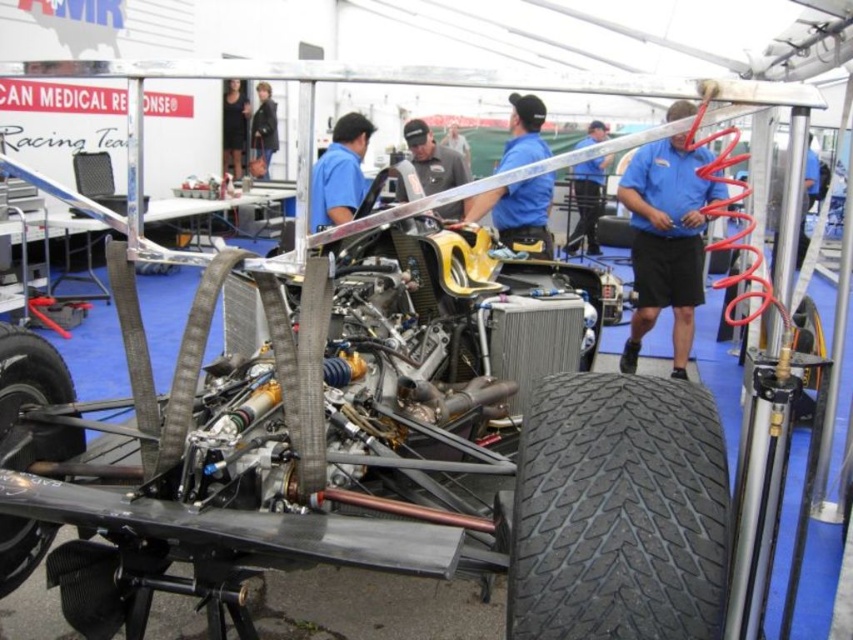
Question: From the image, what is the correct spatial relationship of black rubber tire at lower right in relation to black rubber tire at lower left?

Choices:
 (A) above
 (B) below

Answer: (A)

Question: Does black rubber tire at lower right appear under gray fabric shirt at center?

Choices:
 (A) no
 (B) yes

Answer: (B)

Question: Is black rubber tire at lower left wider than blue shirt at center?

Choices:
 (A) yes
 (B) no

Answer: (B)

Question: Which object is the closest to the blue shirt at center?

Choices:
 (A) blue smooth shirt at center
 (B) gray fabric shirt at center

Answer: (B)

Question: Among these objects, which one is nearest to the camera?

Choices:
 (A) black rubber tire at lower right
 (B) gray fabric shirt at center
 (C) black leather jacket at upper center

Answer: (A)

Question: Which point is closer to the camera?

Choices:
 (A) (625, 186)
 (B) (601, 506)

Answer: (B)